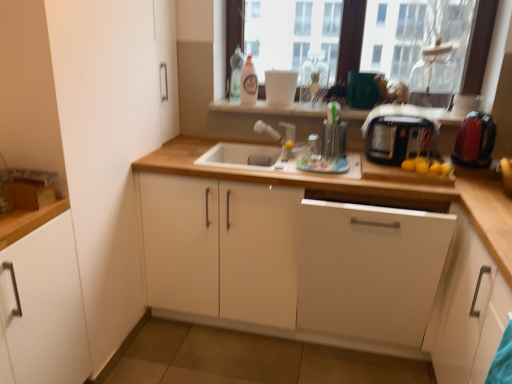
Question: Is satin nickel faucet at center situated inside white matte cabinet at left, which is the fifth cabinetry in right-to-left order, or outside?

Choices:
 (A) outside
 (B) inside

Answer: (A)

Question: From a real-world perspective, relative to white matte cabinet at left, which is the fifth cabinetry in right-to-left order, is satin nickel faucet at center vertically above or below?

Choices:
 (A) below
 (B) above

Answer: (B)

Question: Which object is the closest to the white matte cabinet at lower right, the fourth cabinetry in the left-to-right sequence?

Choices:
 (A) white matte cabinet at center, the fourth cabinetry viewed from the right
 (B) black plastic toaster at right
 (C) shiny red plastic kettle at right
 (D) transparent glass window at upper center
 (E) translucent plastic bottle at upper center, the 1th bottle viewed from the left

Answer: (A)

Question: Considering the real-world distances, which object is farthest from the white matte cabinet at left, which is counted as the 1th cabinetry, starting from the left?

Choices:
 (A) white matte cabinet at center, the fourth cabinetry viewed from the right
 (B) satin nickel faucet at center
 (C) white glossy bottle at upper center, acting as the 2th bottle starting from the left
 (D) transparent glass window at upper center
 (E) translucent plastic bottle at upper center, the third bottle positioned from the right

Answer: (D)